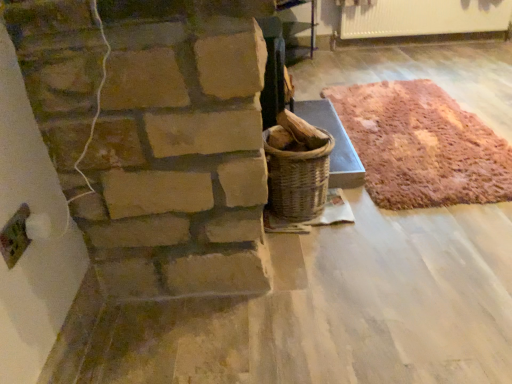
Question: In terms of width, does white glossy radiator at upper right look wider or thinner when compared to rustic woolen rug at right?

Choices:
 (A) thin
 (B) wide

Answer: (A)

Question: From a real-world perspective, is white glossy radiator at upper right above or below rustic woolen rug at right?

Choices:
 (A) above
 (B) below

Answer: (A)

Question: In the image, is white glossy radiator at upper right positioned in front of or behind rustic woolen rug at right?

Choices:
 (A) behind
 (B) front

Answer: (A)

Question: From a real-world perspective, is rustic woolen rug at right positioned above or below white glossy radiator at upper right?

Choices:
 (A) above
 (B) below

Answer: (B)

Question: Relative to white glossy radiator at upper right, is rustic woolen rug at right in front or behind?

Choices:
 (A) behind
 (B) front

Answer: (B)

Question: From the image's perspective, relative to white glossy radiator at upper right, is rustic woolen rug at right above or below?

Choices:
 (A) above
 (B) below

Answer: (B)

Question: Based on their positions, is rustic woolen rug at right located to the left or right of white glossy radiator at upper right?

Choices:
 (A) left
 (B) right

Answer: (A)